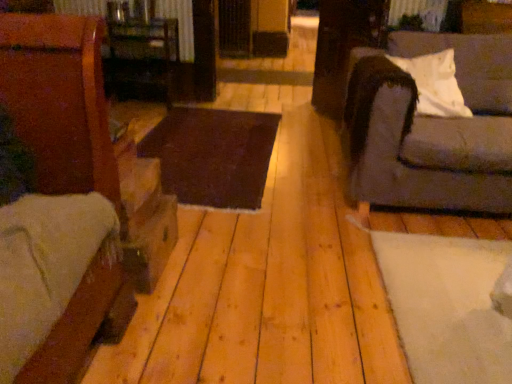
Question: Is white soft pillow at right at the right side of natural wood floor at center?

Choices:
 (A) yes
 (B) no

Answer: (A)

Question: Does white soft pillow at right have a smaller size compared to natural wood floor at center?

Choices:
 (A) yes
 (B) no

Answer: (A)

Question: From a real-world perspective, is white soft pillow at right under natural wood floor at center?

Choices:
 (A) yes
 (B) no

Answer: (B)

Question: Is white soft pillow at right positioned beyond the bounds of natural wood floor at center?

Choices:
 (A) yes
 (B) no

Answer: (A)

Question: Is white soft pillow at right positioned far away from natural wood floor at center?

Choices:
 (A) no
 (B) yes

Answer: (A)

Question: Considering the positions of natural wood floor at center and wooden table at center, the 1th table when ordered from top to bottom, in the image, is natural wood floor at center bigger or smaller than wooden table at center, the 1th table when ordered from top to bottom,?

Choices:
 (A) small
 (B) big

Answer: (B)

Question: In the image, is natural wood floor at center positioned in front of or behind wooden table at center, the 1th table when ordered from top to bottom?

Choices:
 (A) front
 (B) behind

Answer: (A)

Question: Considering the relative positions of natural wood floor at center and wooden table at center, placed as the 2th table when sorted from bottom to top, in the image provided, is natural wood floor at center to the left or to the right of wooden table at center, placed as the 2th table when sorted from bottom to top,?

Choices:
 (A) left
 (B) right

Answer: (B)

Question: Is point 296,362 closer or farther from the camera than point 116,49?

Choices:
 (A) farther
 (B) closer

Answer: (B)

Question: Considering the positions of point (139, 59) and point (355, 145), is point (139, 59) closer or farther from the camera than point (355, 145)?

Choices:
 (A) farther
 (B) closer

Answer: (A)

Question: Is wooden table at center, the 1th table when ordered from top to bottom, taller or shorter than gray fabric couch at right?

Choices:
 (A) short
 (B) tall

Answer: (A)

Question: Would you say wooden table at center, the 1th table when ordered from top to bottom, is to the left or to the right of gray fabric couch at right in the picture?

Choices:
 (A) left
 (B) right

Answer: (A)

Question: Is wooden table at center, the 1th table when ordered from top to bottom, in front of or behind gray fabric couch at right in the image?

Choices:
 (A) front
 (B) behind

Answer: (B)

Question: From a real-world perspective, is gray fabric couch at right above or below natural wood floor at center?

Choices:
 (A) below
 (B) above

Answer: (B)

Question: In the image, is gray fabric couch at right on the left side or the right side of natural wood floor at center?

Choices:
 (A) left
 (B) right

Answer: (B)